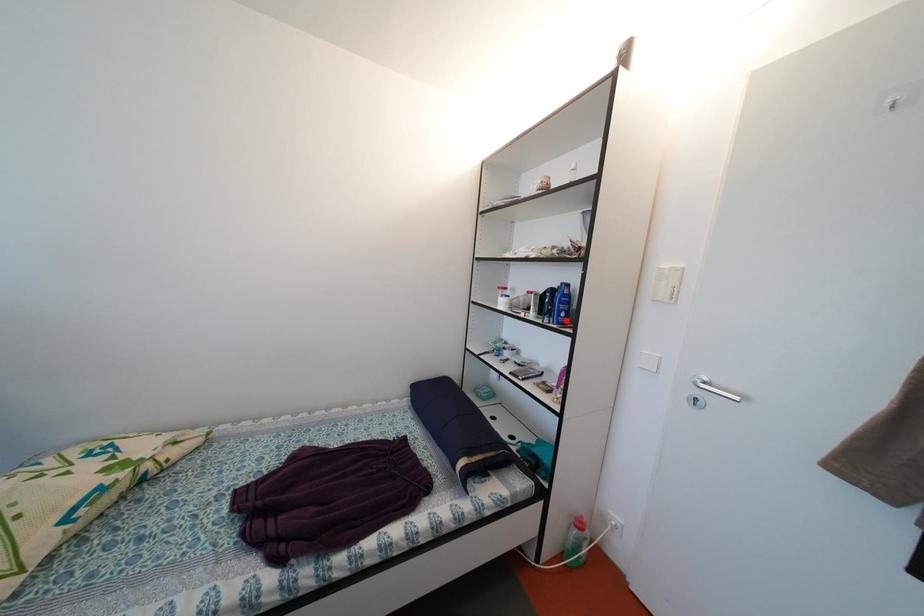
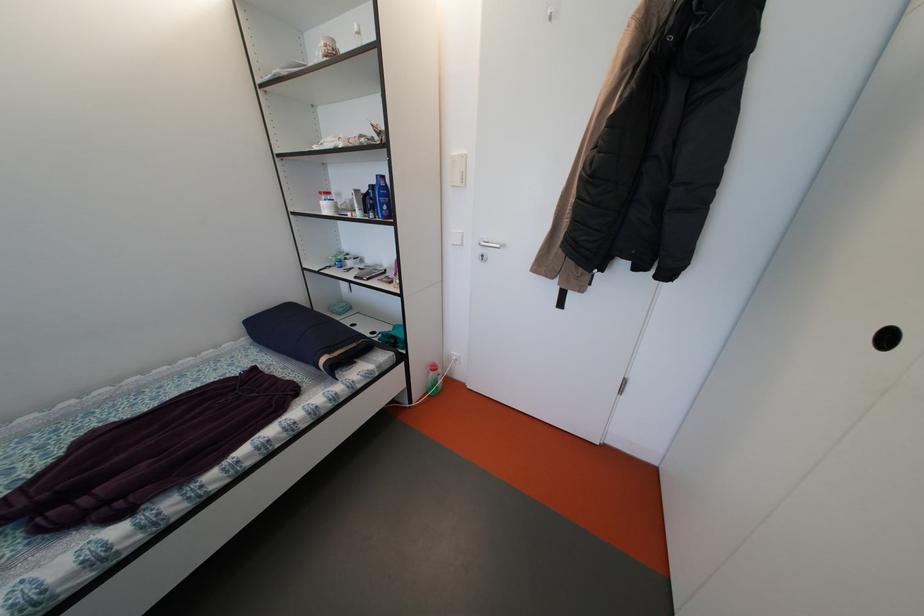
The point at the highlighted location is marked in the first image. Where is the corresponding point in the second image?

(390, 215)